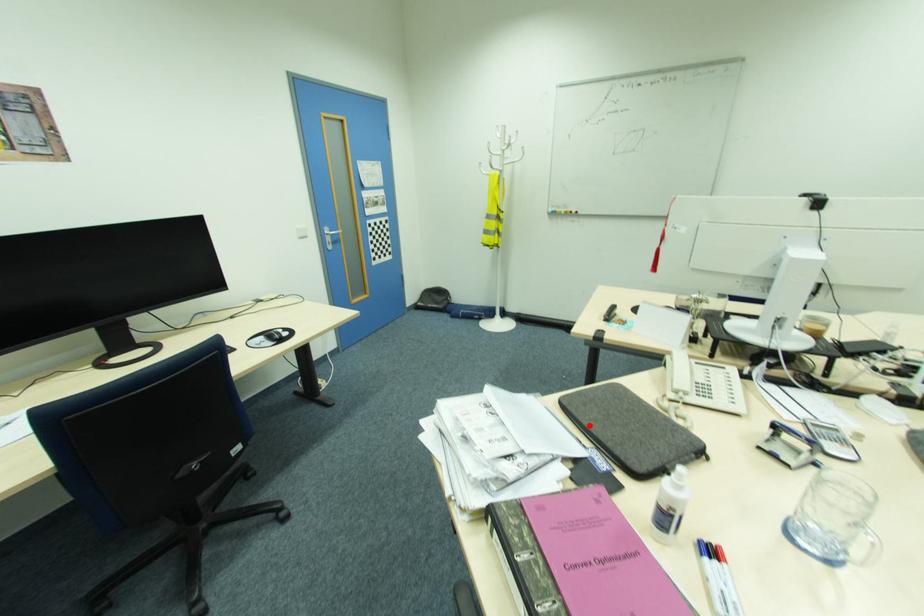
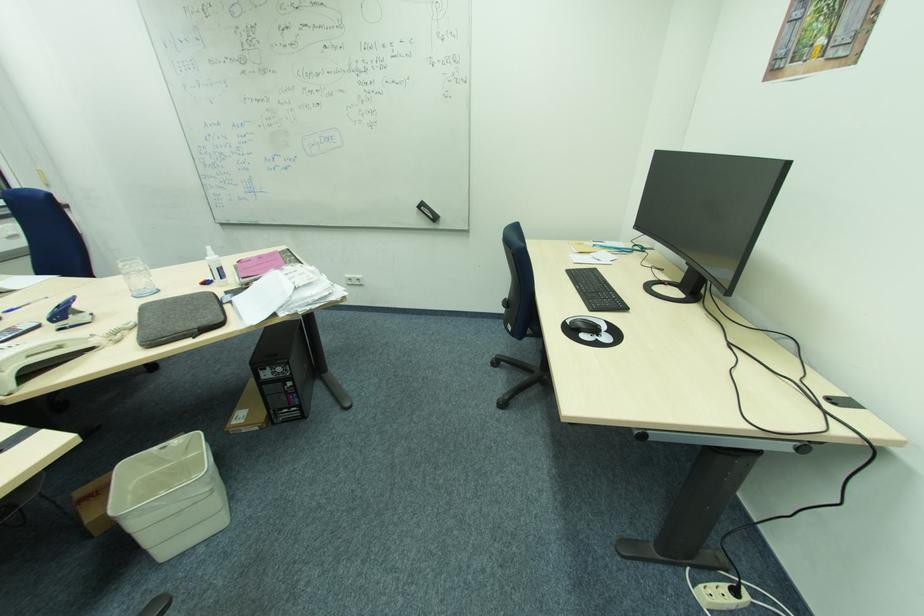
Find the pixel in the second image that matches the highlighted location in the first image.

(222, 306)